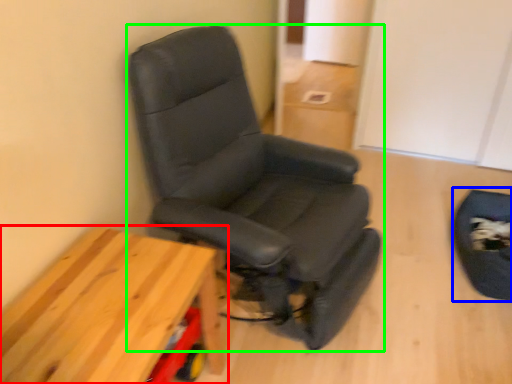
Question: Based on their relative distances, which object is nearer to table (highlighted by a red box)? Choose from swivel chair (highlighted by a blue box) and chair (highlighted by a green box).

Choices:
 (A) swivel chair
 (B) chair

Answer: (B)